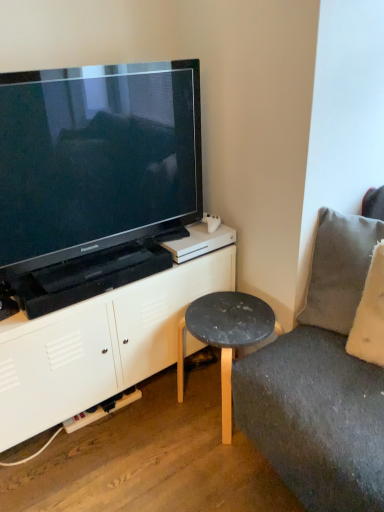
Question: Is gray fabric pillow at right positioned beyond the bounds of matte black stool at lower center?

Choices:
 (A) yes
 (B) no

Answer: (A)

Question: Is gray fabric pillow at right oriented away from matte black stool at lower center?

Choices:
 (A) no
 (B) yes

Answer: (A)

Question: From the image's perspective, is gray fabric pillow at right under matte black stool at lower center?

Choices:
 (A) yes
 (B) no

Answer: (B)

Question: Considering the relative positions of gray fabric pillow at right and matte black stool at lower center in the image provided, is gray fabric pillow at right to the right of matte black stool at lower center from the viewer's perspective?

Choices:
 (A) yes
 (B) no

Answer: (A)

Question: Is gray fabric pillow at right wider than matte black stool at lower center?

Choices:
 (A) yes
 (B) no

Answer: (B)

Question: Visually, is gray fabric pillow at right positioned to the left or to the right of white matte cabinet at lower left?

Choices:
 (A) right
 (B) left

Answer: (A)

Question: Based on their sizes in the image, would you say gray fabric pillow at right is bigger or smaller than white matte cabinet at lower left?

Choices:
 (A) big
 (B) small

Answer: (B)

Question: Considering the positions of point click(334, 261) and point click(94, 304), is point click(334, 261) closer or farther from the camera than point click(94, 304)?

Choices:
 (A) closer
 (B) farther

Answer: (B)

Question: From the image's perspective, relative to white matte cabinet at lower left, is gray fabric pillow at right above or below?

Choices:
 (A) above
 (B) below

Answer: (A)

Question: From a real-world perspective, is white matte cabinet at lower left positioned above or below matte black stool at lower center?

Choices:
 (A) below
 (B) above

Answer: (B)

Question: In terms of width, does white matte cabinet at lower left look wider or thinner when compared to matte black stool at lower center?

Choices:
 (A) thin
 (B) wide

Answer: (B)

Question: Is white matte cabinet at lower left inside or outside of matte black stool at lower center?

Choices:
 (A) outside
 (B) inside

Answer: (A)

Question: Is white matte cabinet at lower left to the left or to the right of matte black stool at lower center in the image?

Choices:
 (A) right
 (B) left

Answer: (B)

Question: Considering the positions of white matte cabinet at lower left and black glossy television at upper left in the image, is white matte cabinet at lower left wider or thinner than black glossy television at upper left?

Choices:
 (A) wide
 (B) thin

Answer: (A)

Question: From a real-world perspective, is white matte cabinet at lower left positioned above or below black glossy television at upper left?

Choices:
 (A) above
 (B) below

Answer: (B)